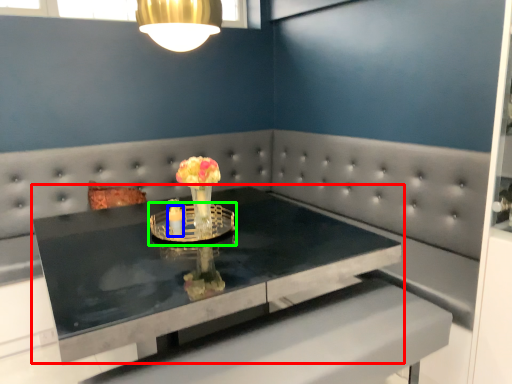
Question: Considering the real-world distances, which object is closest to table (highlighted by a red box)? candle holder (highlighted by a blue box) or candle holder (highlighted by a green box).

Choices:
 (A) candle holder
 (B) candle holder

Answer: (B)